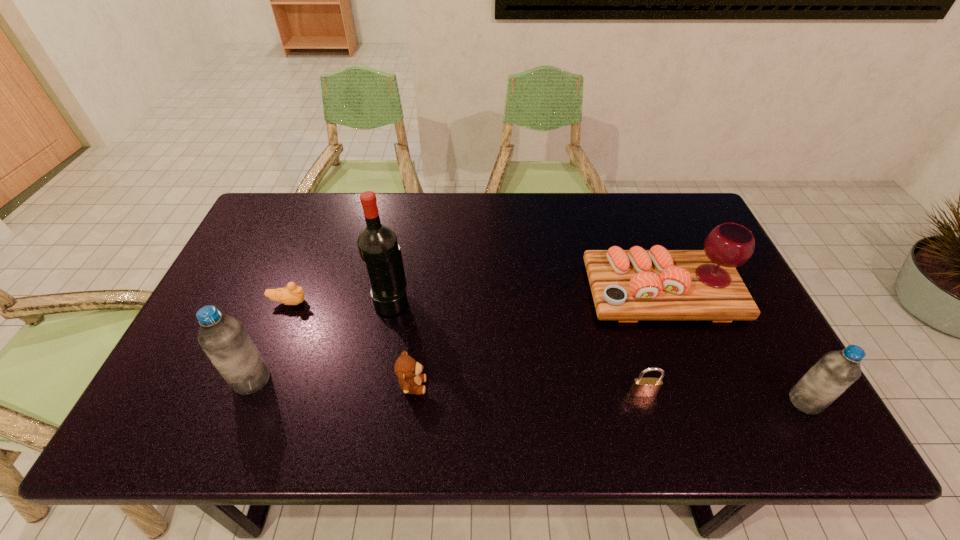
This screenshot has width=960, height=540. I want to click on platter positioned at the right edge, so click(658, 284).

Identify the location of object present at the near left corner. (223, 338).

In order to click on object at the near right corner in this screenshot , I will do `click(835, 371)`.

In the image, there is a desktop. At what (x,y) coordinates should I click in order to perform the action: click on free region at the far edge. Please return your answer as a coordinate pair (x, y). Image resolution: width=960 pixels, height=540 pixels. Looking at the image, I should click on (593, 203).

Locate an element on the screen. The height and width of the screenshot is (540, 960). free spot at the near edge of the desktop is located at coordinates (336, 379).

The width and height of the screenshot is (960, 540). I want to click on free spot at the left edge of the desktop, so click(x=218, y=301).

Locate an element on the screen. vacant space at the right edge is located at coordinates (x=695, y=244).

At what (x,y) coordinates should I click in order to perform the action: click on vacant region at the far left corner of the desktop. Please return your answer as a coordinate pair (x, y). Looking at the image, I should click on (256, 237).

Locate an element on the screen. This screenshot has height=540, width=960. vacant space at the far right corner of the desktop is located at coordinates (689, 206).

This screenshot has height=540, width=960. Find the location of `blank space at the near right corner`. blank space at the near right corner is located at coordinates (788, 399).